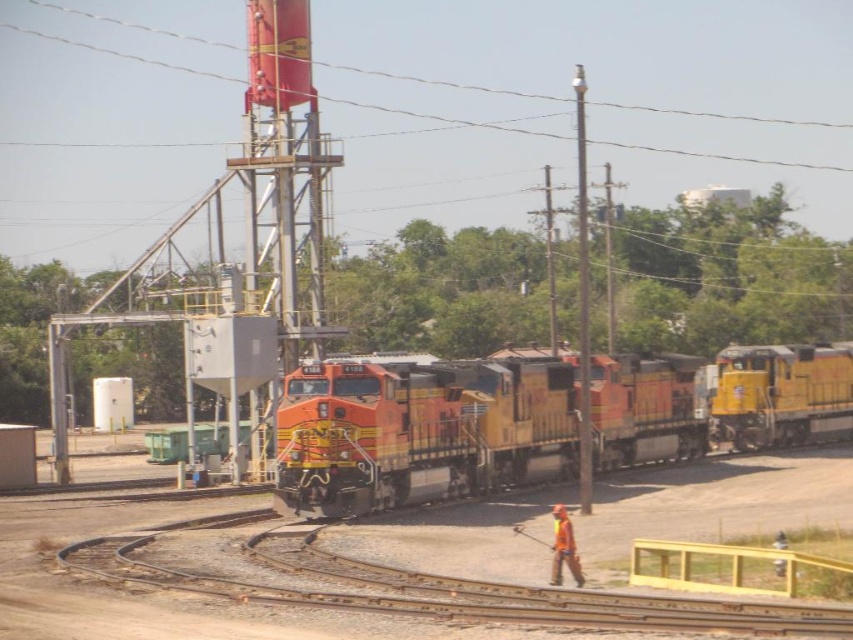
Can you confirm if orange hard hat at lower right is wider than orange fabric safety vest at lower center?

Yes.

Between point (563, 540) and point (566, 540), which one is positioned in front?

Point (566, 540)

This screenshot has height=640, width=853. In order to click on orange hard hat at lower right in this screenshot , I will do `click(563, 547)`.

How distant is smooth steel train track at lower center from metallic wire at upper center?

smooth steel train track at lower center and metallic wire at upper center are 175.07 meters apart from each other.

Does point (96, 573) come farther from viewer compared to point (840, 168)?

That is False.

Which is behind, point (531, 586) or point (99, 17)?

The point (99, 17) is behind.

Locate an element on the screen. smooth steel train track at lower center is located at coordinates (421, 586).

Does orange/yellow locomotive at center come in front of smooth steel train track at lower center?

No, orange/yellow locomotive at center is further to the viewer.

Is orange/yellow locomotive at center below smooth steel train track at lower center?

Actually, orange/yellow locomotive at center is above smooth steel train track at lower center.

Does point (358, 406) come farther from viewer compared to point (80, 561)?

Yes, point (358, 406) is behind point (80, 561).

The image size is (853, 640). I want to click on orange/yellow locomotive at center, so click(421, 429).